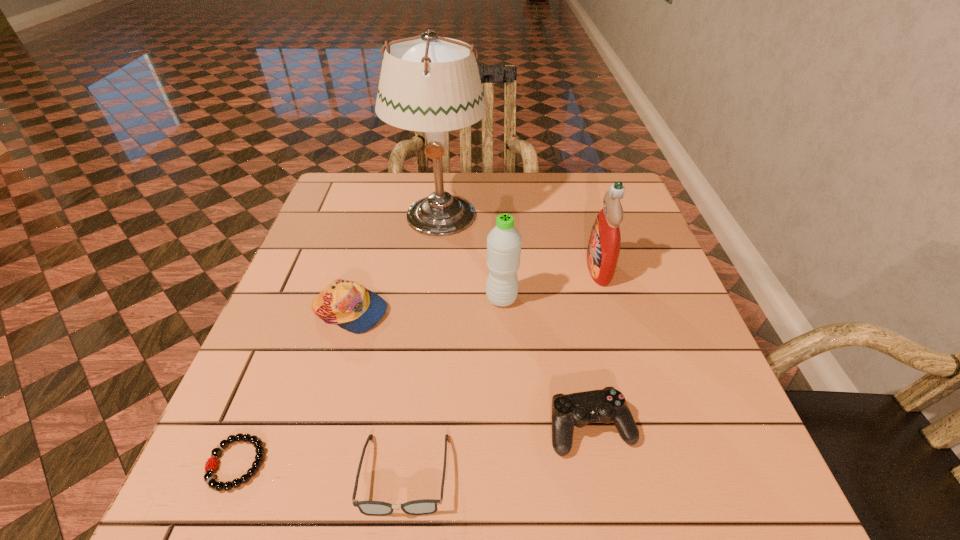
Find the location of a particular element. Image resolution: width=960 pixels, height=540 pixels. free space that satisfies the following two spatial constraints: 1. on the back side of the control; 2. on the left side of the shortest object is located at coordinates (251, 428).

Locate an element on the screen. This screenshot has height=540, width=960. blank area in the image that satisfies the following two spatial constraints: 1. on the bill of the cap; 2. on the right side of the control is located at coordinates (316, 428).

This screenshot has height=540, width=960. Identify the location of free space that satisfies the following two spatial constraints: 1. on the lampshade of the control; 2. on the right side of the farthest object. (415, 428).

Find the location of a particular element. vacant area that satisfies the following two spatial constraints: 1. on the lampshade of the farthest object; 2. on the right side of the control is located at coordinates (415, 428).

This screenshot has width=960, height=540. What are the coordinates of `free space that satisfies the following two spatial constraints: 1. on the bill of the control; 2. on the left side of the cap` in the screenshot? It's located at (316, 428).

Locate an element on the screen. This screenshot has height=540, width=960. free spot that satisfies the following two spatial constraints: 1. on the bill of the cap; 2. on the front side of the shortest object is located at coordinates (306, 463).